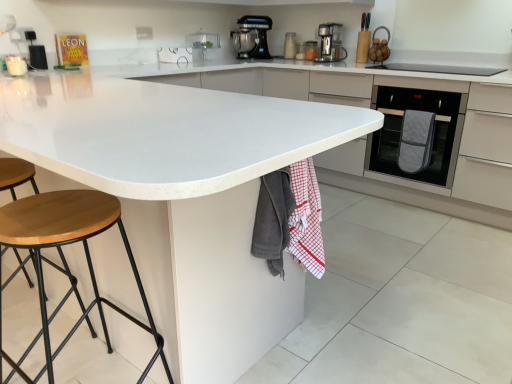
Question: Considering the relative sizes of wooden seat stool at lower left and metallic black stand mixer at upper center, marked as the first kitchen appliance in a back-to-front arrangement, in the image provided, is wooden seat stool at lower left smaller than metallic black stand mixer at upper center, marked as the first kitchen appliance in a back-to-front arrangement,?

Choices:
 (A) no
 (B) yes

Answer: (A)

Question: Is wooden seat stool at lower left facing towards metallic black stand mixer at upper center, the 1th kitchen appliance when ordered from left to right?

Choices:
 (A) yes
 (B) no

Answer: (B)

Question: Is wooden seat stool at lower left next to metallic black stand mixer at upper center, the 1th kitchen appliance when ordered from left to right, and touching it?

Choices:
 (A) yes
 (B) no

Answer: (B)

Question: Is wooden seat stool at lower left to the left of metallic black stand mixer at upper center, marked as the first kitchen appliance in a back-to-front arrangement, from the viewer's perspective?

Choices:
 (A) no
 (B) yes

Answer: (B)

Question: Does wooden seat stool at lower left have a lesser width compared to metallic black stand mixer at upper center, the 1th kitchen appliance when ordered from left to right?

Choices:
 (A) yes
 (B) no

Answer: (B)

Question: Is metallic black stand mixer at upper center, the 1th kitchen appliance when ordered from left to right, surrounded by wooden seat stool at lower left?

Choices:
 (A) no
 (B) yes

Answer: (A)

Question: Is black plastic speaker at upper left, the fourth appliance when ordered from right to left, not within quilted fabric oven mitt at right, placed as the 1th blanket when sorted from right to left?

Choices:
 (A) yes
 (B) no

Answer: (A)

Question: From a real-world perspective, is black plastic speaker at upper left, which ranks as the 1th appliance in left-to-right order, on quilted fabric oven mitt at right, placed as the 1th blanket when sorted from right to left?

Choices:
 (A) no
 (B) yes

Answer: (B)

Question: Is black plastic speaker at upper left, the fourth appliance when ordered from right to left, turned away from quilted fabric oven mitt at right, placed as the 3th blanket when sorted from front to back?

Choices:
 (A) no
 (B) yes

Answer: (A)

Question: Does black plastic speaker at upper left, the fourth appliance when ordered from right to left, appear on the right side of quilted fabric oven mitt at right, placed as the 1th blanket when sorted from back to front?

Choices:
 (A) no
 (B) yes

Answer: (A)

Question: Is black plastic speaker at upper left, the fourth appliance when ordered from right to left, facing towards quilted fabric oven mitt at right, placed as the 1th blanket when sorted from right to left?

Choices:
 (A) no
 (B) yes

Answer: (A)

Question: Is black plastic speaker at upper left, which ranks as the 1th appliance in left-to-right order, taller than quilted fabric oven mitt at right, placed as the 1th blanket when sorted from right to left?

Choices:
 (A) no
 (B) yes

Answer: (A)

Question: Is red checkered towel at lower center, positioned as the 2th blanket in right-to-left order, closer to the viewer compared to wooden seat stool at lower left?

Choices:
 (A) no
 (B) yes

Answer: (A)